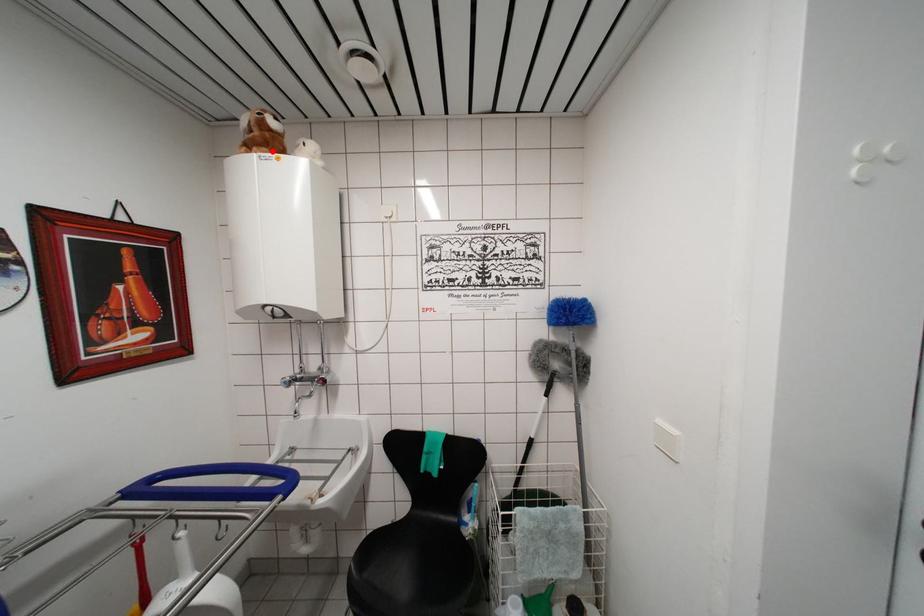
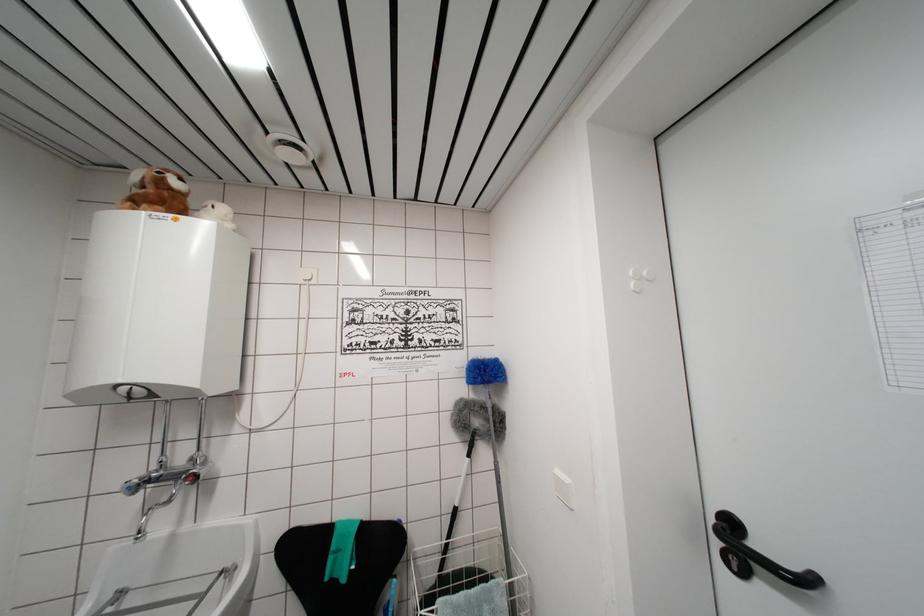
Locate, in the second image, the point that corresponds to the highlighted location in the first image.

(168, 209)